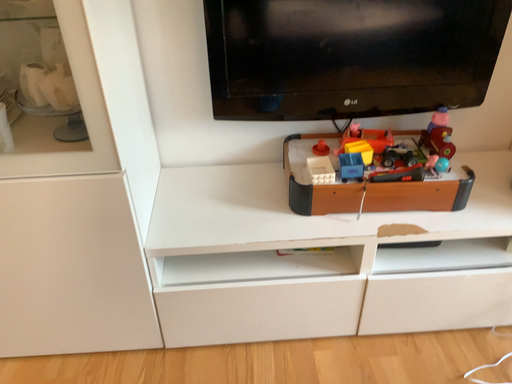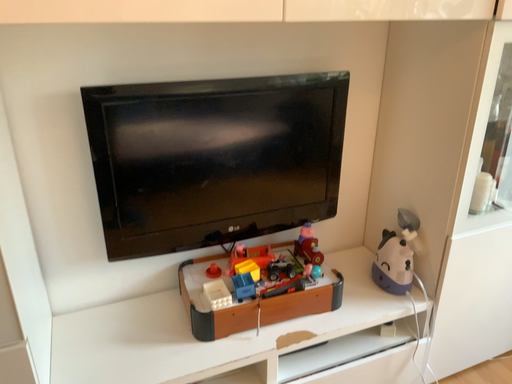
Question: Which way did the camera rotate in the video?

Choices:
 (A) rotated downward
 (B) rotated upward

Answer: (B)